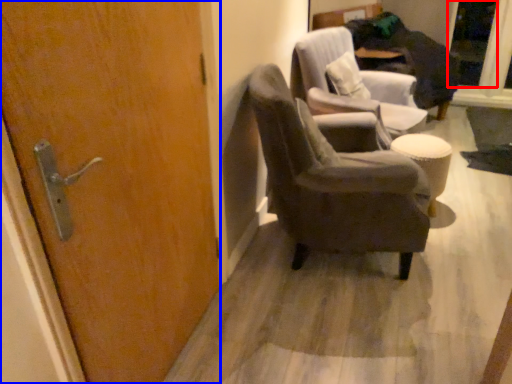
Question: Among these objects, which one is farthest to the camera, glass door (highlighted by a red box) or door (highlighted by a blue box)?

Choices:
 (A) glass door
 (B) door

Answer: (A)